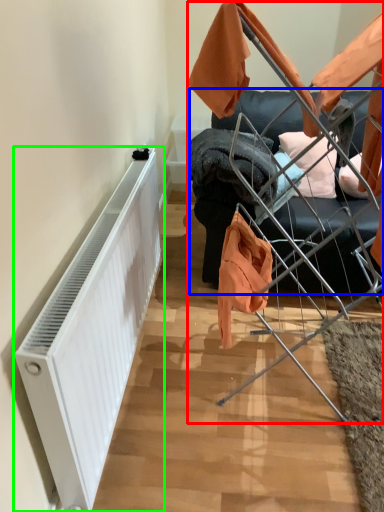
Question: Considering the real-world distances, which object is farthest from baby carriage (highlighted by a red box)? furniture (highlighted by a blue box) or radiator (highlighted by a green box)?

Choices:
 (A) furniture
 (B) radiator

Answer: (B)